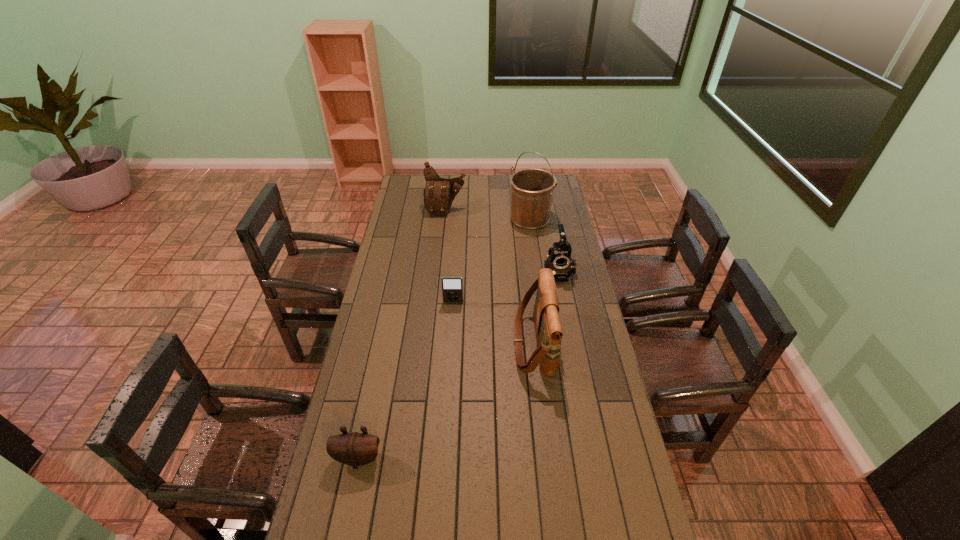
Identify the location of the tallest object. The height and width of the screenshot is (540, 960). (532, 189).

At what (x,y) coordinates should I click in order to perform the action: click on the farther shoulder bag. Please return your answer as a coordinate pair (x, y). Looking at the image, I should click on (439, 193).

The image size is (960, 540). I want to click on the right shoulder bag, so click(x=549, y=333).

This screenshot has height=540, width=960. Find the location of `the second nearest object`. the second nearest object is located at coordinates (549, 333).

Find the location of `the third farthest object`. the third farthest object is located at coordinates (559, 260).

Find the location of `the fourth tallest object`. the fourth tallest object is located at coordinates (559, 260).

This screenshot has height=540, width=960. In order to click on the third nearest object in this screenshot , I will do `click(452, 287)`.

Identify the location of the nearest object. Image resolution: width=960 pixels, height=540 pixels. (355, 449).

Locate an element on the screen. Image resolution: width=960 pixels, height=540 pixels. pouch is located at coordinates (355, 449).

Locate an element on the screen. free location located on the back of the bucket is located at coordinates point(525,187).